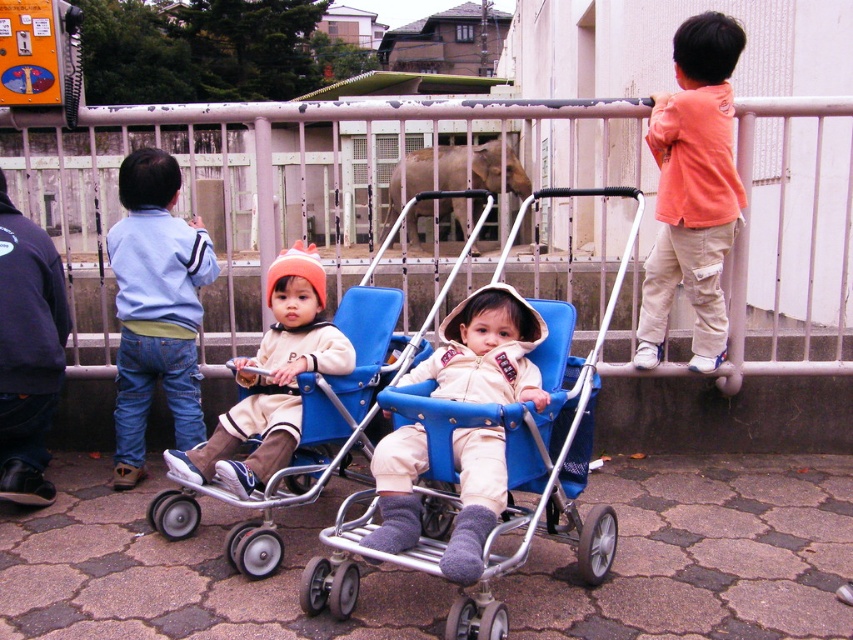
You are a zookeeper who needs to ensure there is enough space between the beige soft fabric baby stroller at center and the matte beige jacket at center for a small animal to pass through. The animal requires a minimum of 20 inches of space. Can the animal pass through?

The beige soft fabric baby stroller at center is 23.80 inches from matte beige jacket at center, which is more than the required 20 inches, so the animal can pass through.

You are a zookeeper responsible for ensuring safety between the visitors and the animals. You notice the blue plastic baby carriage at center and the matte beige jacket at center. Based on their sizes, which object could potentially block the view of the elephant for visitors standing behind it?

The blue plastic baby carriage at center is wider than the matte beige jacket at center, so it could potentially block the view more effectively for visitors standing behind it.